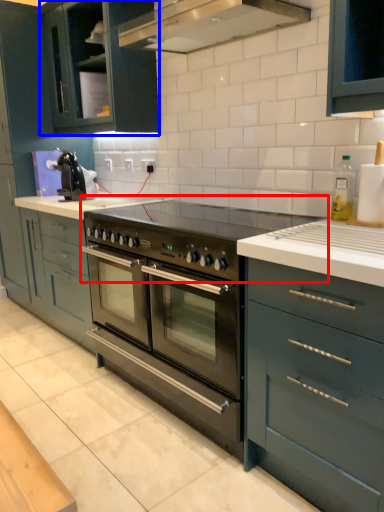
Question: Which of the following is the closest to the observer, gas stove (highlighted by a red box) or cabinetry (highlighted by a blue box)?

Choices:
 (A) gas stove
 (B) cabinetry

Answer: (A)